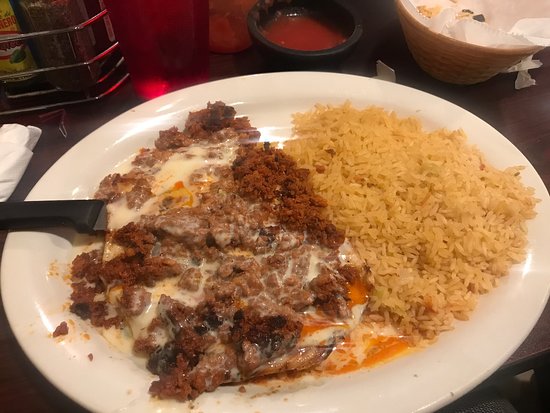
Find the location of `1 small black sauce bowl`. 1 small black sauce bowl is located at coordinates (338, 40).